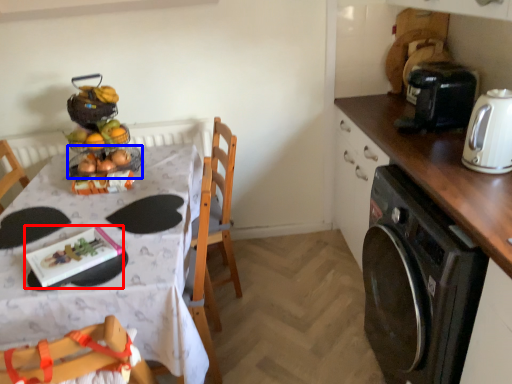
Question: Which object is further to the camera taking this photo, tableware (highlighted by a red box) or basket (highlighted by a blue box)?

Choices:
 (A) tableware
 (B) basket

Answer: (B)